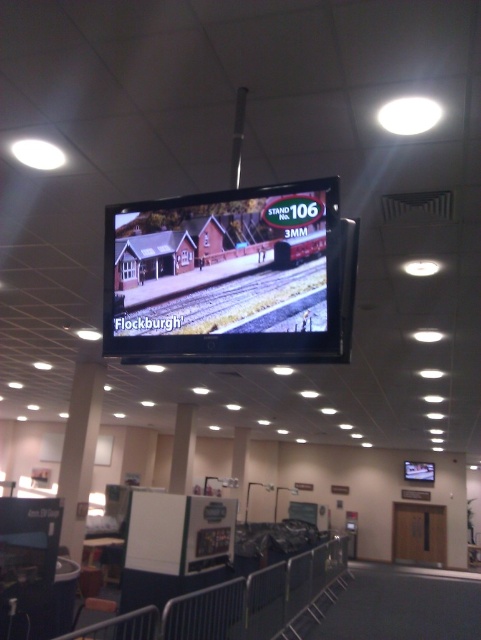
Question: From the image, what is the correct spatial relationship of matte black screen at center in relation to brown gravel train track at center?

Choices:
 (A) below
 (B) above

Answer: (B)

Question: Is matte black screen at center to the left of brown gravel train track at center from the viewer's perspective?

Choices:
 (A) no
 (B) yes

Answer: (B)

Question: Which of the following is the farthest from the observer?

Choices:
 (A) matte black screen at center
 (B) brown gravel train track at center

Answer: (B)

Question: Which point appears farthest from the camera in this image?

Choices:
 (A) (277, 269)
 (B) (139, 259)

Answer: (B)

Question: Is matte black screen at center positioned before brown gravel train track at center?

Choices:
 (A) no
 (B) yes

Answer: (B)